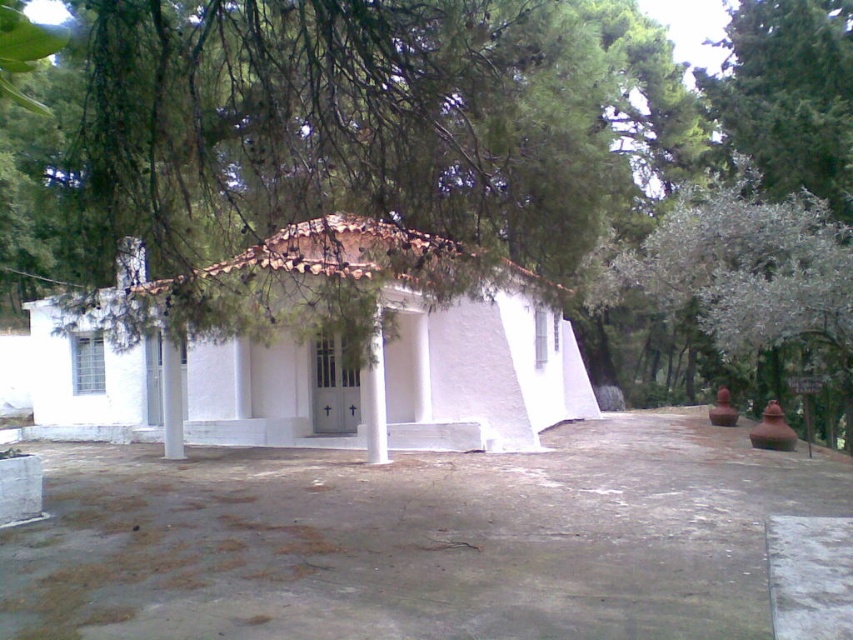
You are planning to install a new lighting fixture between the green leafy tree at center and the white smooth column at center. Based on their widths, which object should the fixture be designed to accommodate in terms of spacing?

The green leafy tree at center might be wider than the white smooth column at center, so the lighting fixture should be designed to accommodate the width of the green leafy tree at center to ensure proper spacing.

You are standing in front of the white smooth hut at center and want to take a photo of it. Since there is a green leafy tree at center nearby, will the tree block the entire view of the hut when you take the photo?

The green leafy tree at center is wider than the white smooth hut at center, so the tree may block part of the hut in the photo, but not the entire view because the description only mentions the tree being wider, not taller or positioned directly in front.